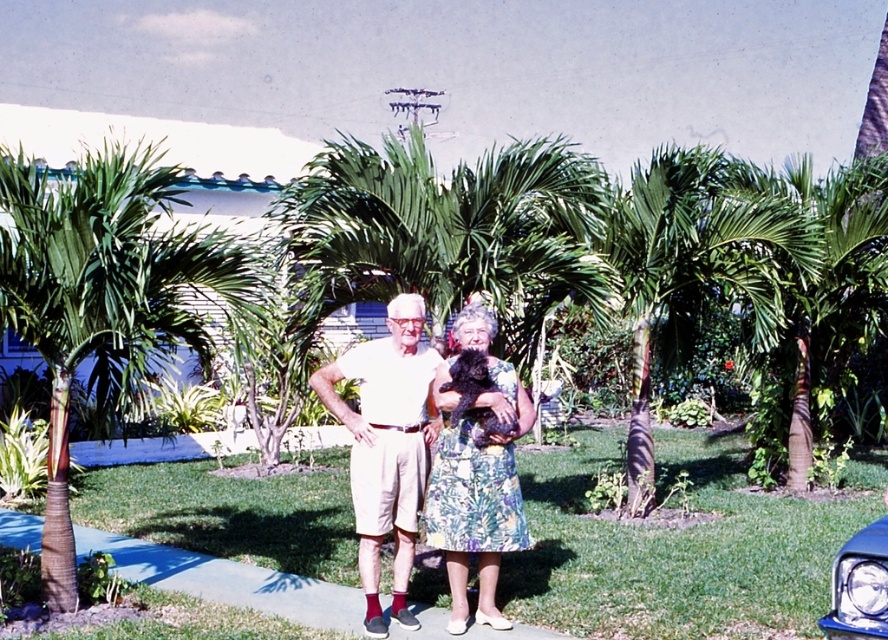
Does green leafy palm tree at left have a lesser width compared to green leafy palm tree at center-right?

No, green leafy palm tree at left is not thinner than green leafy palm tree at center-right.

Which is more to the left, green leafy palm tree at left or green leafy palm tree at center-right?

From the viewer's perspective, green leafy palm tree at left appears more on the left side.

Which is in front, point (48, 531) or point (797, 387)?

Point (48, 531)

Find the location of a particular element. green leafy palm tree at left is located at coordinates (104, 298).

Between white cotton shorts at center and floral dress at center, which one appears on the right side from the viewer's perspective?

Positioned to the right is floral dress at center.

Describe the element at coordinates (387, 445) in the screenshot. I see `white cotton shorts at center` at that location.

Locate an element on the screen. white cotton shorts at center is located at coordinates (387, 445).

Does point (170, 273) lie in front of point (866, 557)?

No, it is behind (866, 557).

Who is positioned more to the left, green leafy palm tree at left or blue glossy car at lower right?

Positioned to the left is green leafy palm tree at left.

Does point (54, 387) come closer to viewer compared to point (833, 588)?

No.

Find the location of a particular element. The height and width of the screenshot is (640, 888). green leafy palm tree at left is located at coordinates (104, 298).